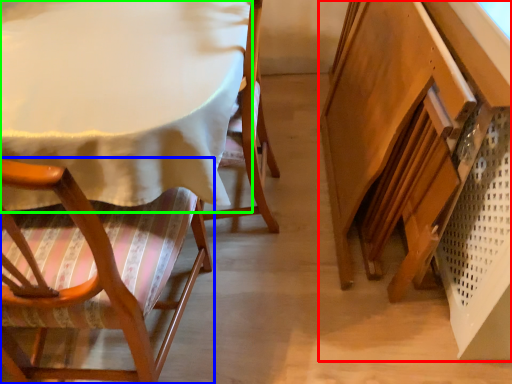
Question: Which object is positioned closest to vanity (highlighted by a red box)? Select from chair (highlighted by a blue box) and table (highlighted by a green box).

Choices:
 (A) chair
 (B) table

Answer: (B)